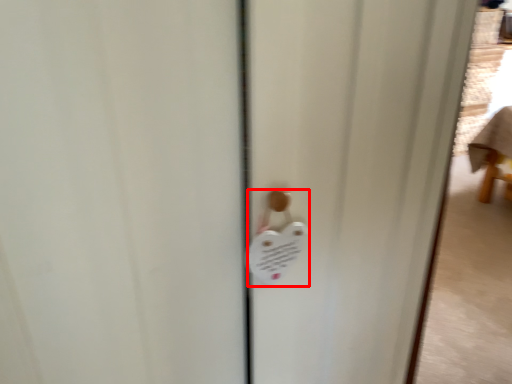
Question: Considering the relative positions of lock (annotated by the red box) and screen door in the image provided, where is lock (annotated by the red box) located with respect to the staircase?

Choices:
 (A) right
 (B) left

Answer: (B)